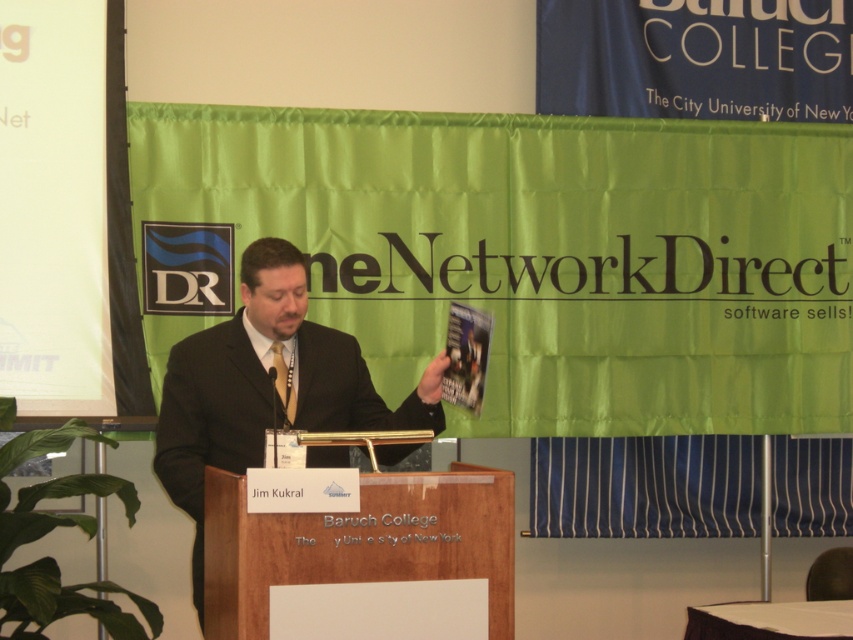
You are an event photographer at the conference. You need to capture a clear photo of the speaker Jim Kukral. However, there is an obstruction between the camera and the speaker. Which object is closer to the camera between the black suit at center and the silky gold tie at center?

The black suit at center is closer to the camera than the silky gold tie at center because the black suit at center is in front of the silky gold tie at center.